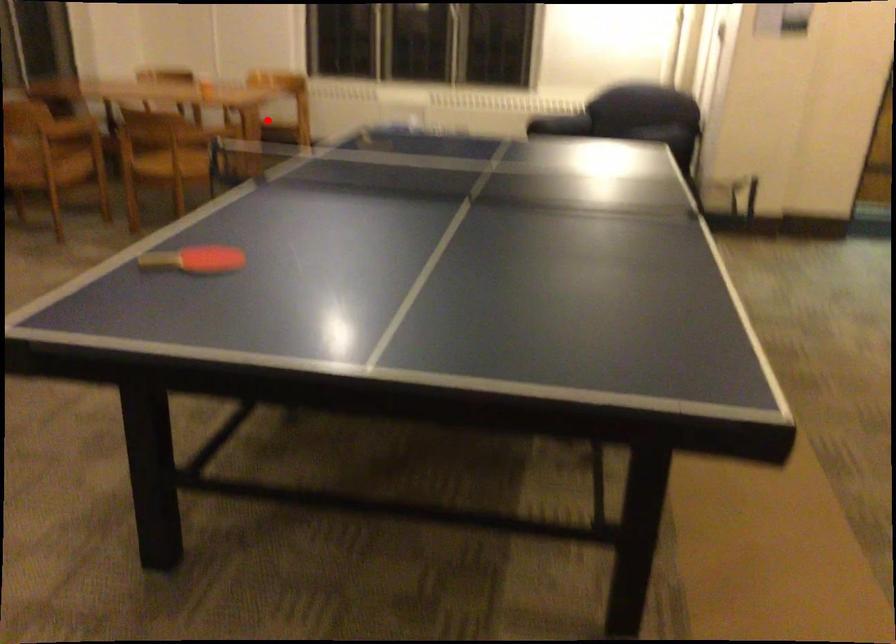
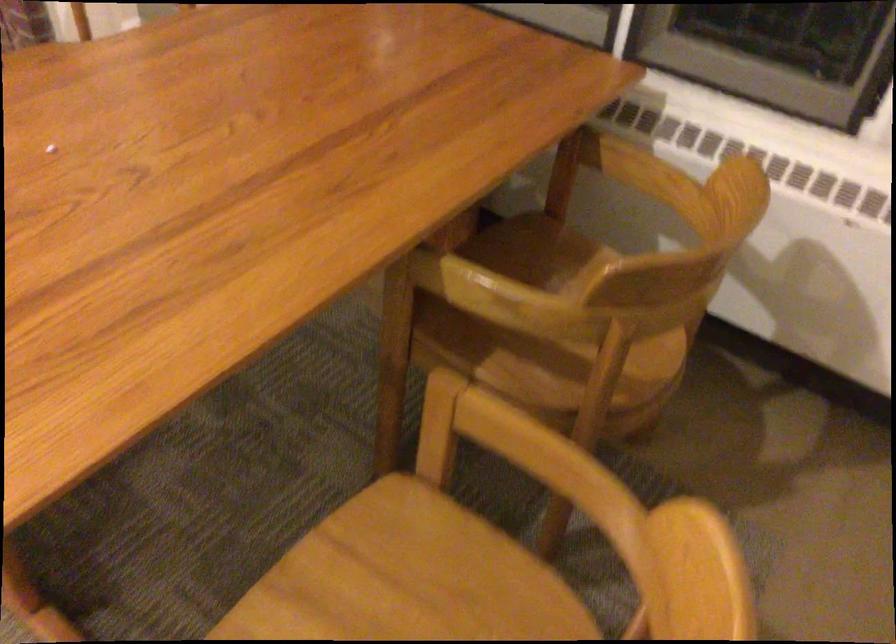
Find the pixel in the second image that matches the highlighted location in the first image.

(407, 579)